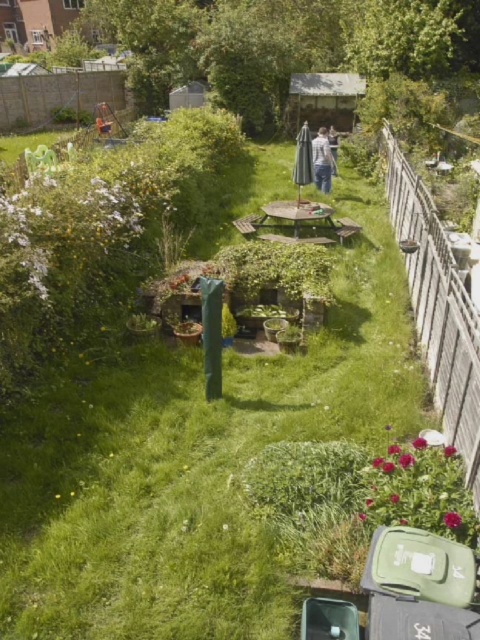
Question: Does white wooden fence at right appear under white cotton shirt at center?

Choices:
 (A) yes
 (B) no

Answer: (A)

Question: Which object appears farthest from the camera in this image?

Choices:
 (A) white wooden fence at right
 (B) white cotton shirt at center

Answer: (B)

Question: Does white wooden fence at right appear under white cotton shirt at center?

Choices:
 (A) no
 (B) yes

Answer: (B)

Question: Which point is closer to the camera taking this photo?

Choices:
 (A) (314, 164)
 (B) (400, 188)

Answer: (B)

Question: Where is white wooden fence at right located in relation to white cotton shirt at center in the image?

Choices:
 (A) right
 (B) left

Answer: (A)

Question: Which point is closer to the camera?

Choices:
 (A) white cotton shirt at center
 (B) white wooden fence at right

Answer: (B)